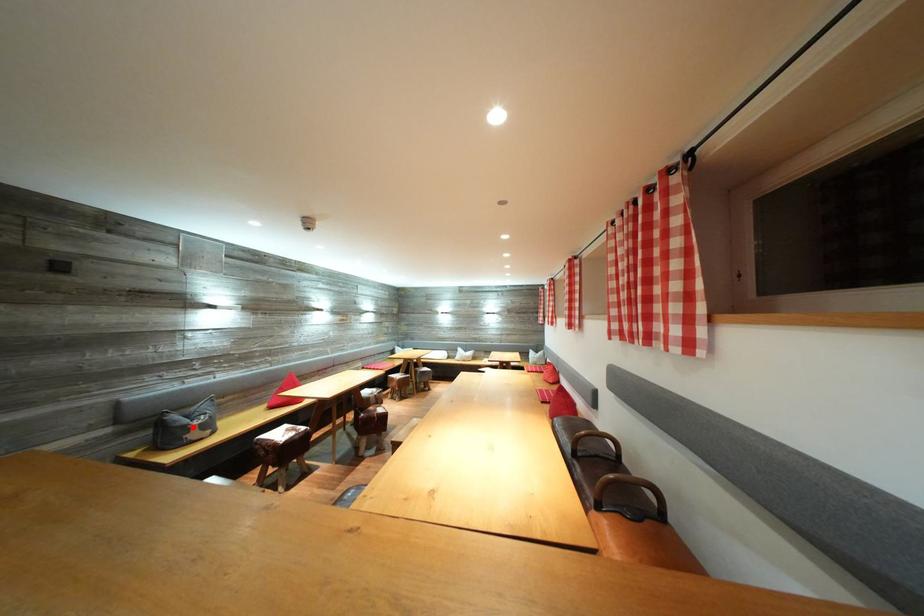
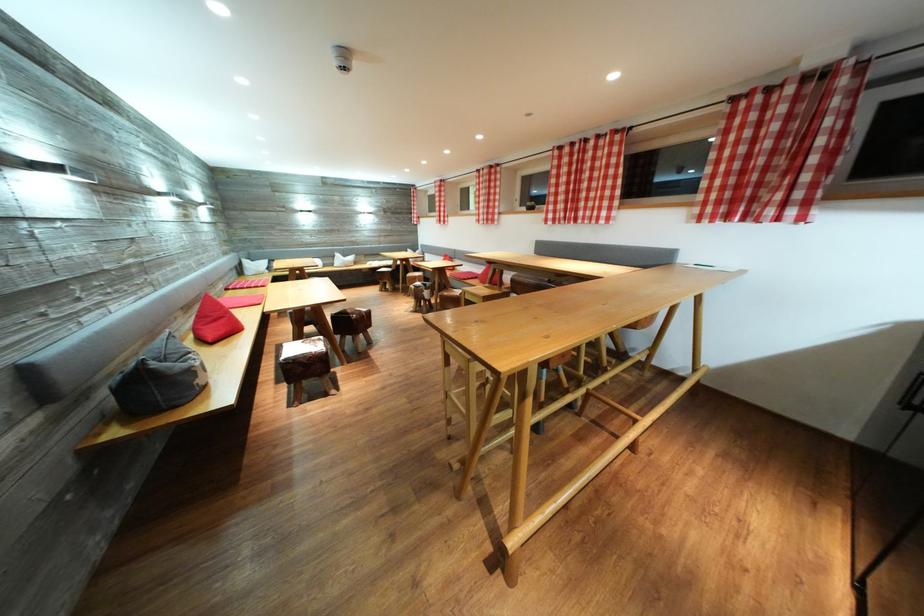
Question: I am providing you with two images of the same scene from different viewpoints. A red point is marked on the first image. Can you still see the location of the red point in image 2?

Choices:
 (A) Yes
 (B) No

Answer: (A)